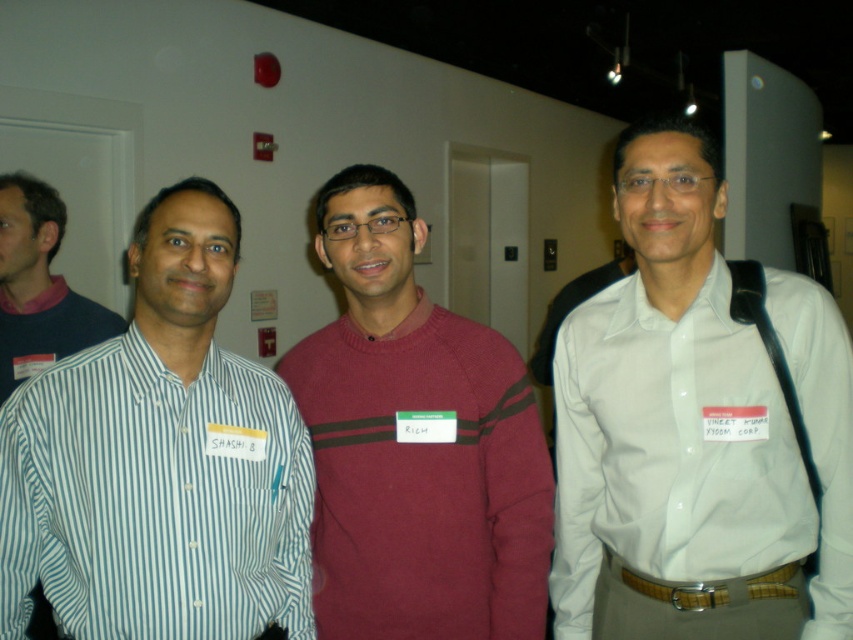
Question: Is white striped shirt at left to the left of white cotton shirt at right from the viewer's perspective?

Choices:
 (A) yes
 (B) no

Answer: (A)

Question: Is maroon sweater at center to the left of white cotton shirt at right from the viewer's perspective?

Choices:
 (A) yes
 (B) no

Answer: (A)

Question: Which object is the closest to the maroon sweater at center?

Choices:
 (A) white cotton shirt at right
 (B) white striped shirt at left
 (C) striped cotton shirt at left

Answer: (A)

Question: Which point appears farthest from the camera in this image?

Choices:
 (A) (32, 221)
 (B) (608, 403)
 (C) (340, 273)
 (D) (201, 477)

Answer: (A)

Question: Which point appears farthest from the camera in this image?

Choices:
 (A) (225, 577)
 (B) (447, 602)
 (C) (13, 378)
 (D) (582, 381)

Answer: (C)

Question: Is white striped shirt at left positioned in front of striped cotton shirt at left?

Choices:
 (A) yes
 (B) no

Answer: (A)